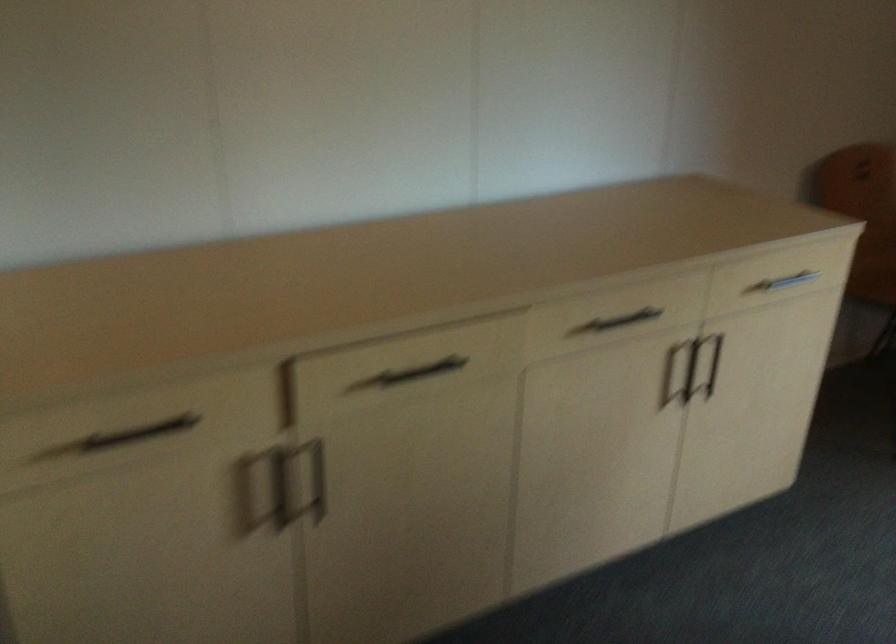
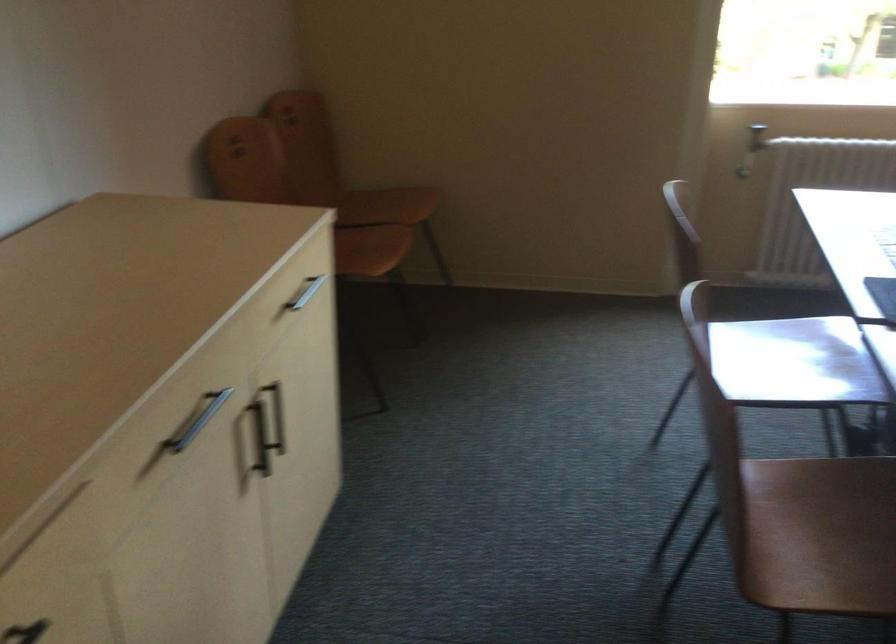
In the second image, find the point that corresponds to (x=694, y=375) in the first image.

(260, 438)